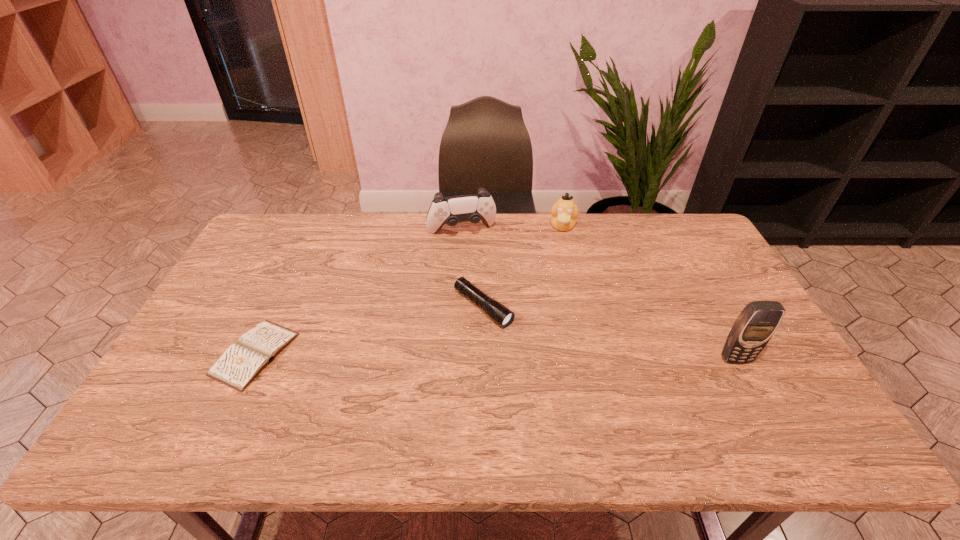
This screenshot has height=540, width=960. I want to click on vacant space located 0.250m at the lens end of the fourth tallest object, so click(x=575, y=379).

You are a GUI agent. You are given a task and a screenshot of the screen. Output one action in this format:
    pyautogui.click(x=<x>, y=<y>)
    Task: Click on the vacant space situated 0.200m at the lens end of the fourth tallest object
    This screenshot has width=960, height=540.
    Given the screenshot: What is the action you would take?
    pyautogui.click(x=560, y=367)

Locate an element on the screen. Image resolution: width=960 pixels, height=540 pixels. vacant position located 0.080m at the lens end of the fourth tallest object is located at coordinates (525, 341).

Find the location of a particular element. The height and width of the screenshot is (540, 960). vacant space located on the front-facing side of the control is located at coordinates (471, 253).

Where is `vacant space located on the front-facing side of the control`? This screenshot has width=960, height=540. vacant space located on the front-facing side of the control is located at coordinates (481, 281).

In order to click on free space located 0.320m on the front-facing side of the control in this screenshot , I will do [490, 308].

Locate an element on the screen. vacant region located 0.200m on the face of the third shortest object is located at coordinates (558, 275).

Identify the location of vacant space located on the face of the third shortest object. Image resolution: width=960 pixels, height=540 pixels. (556, 299).

The width and height of the screenshot is (960, 540). Identify the location of vacant region located 0.380m on the face of the third shortest object. (554, 315).

Where is `control present at the far edge`? Image resolution: width=960 pixels, height=540 pixels. control present at the far edge is located at coordinates (472, 208).